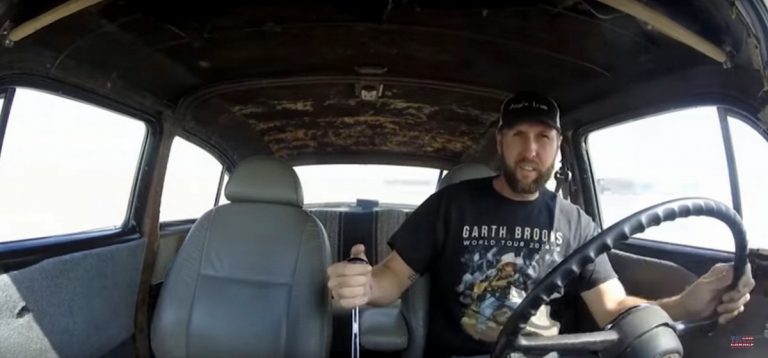
Identify the location of windows. (104, 181), (202, 178), (325, 178), (634, 155), (749, 168).